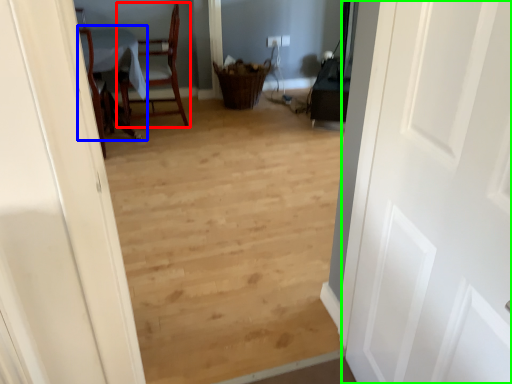
Question: Estimate the real-world distances between objects in this image. Which object is closer to chair (highlighted by a red box), table (highlighted by a blue box) or door (highlighted by a green box)?

Choices:
 (A) table
 (B) door

Answer: (A)